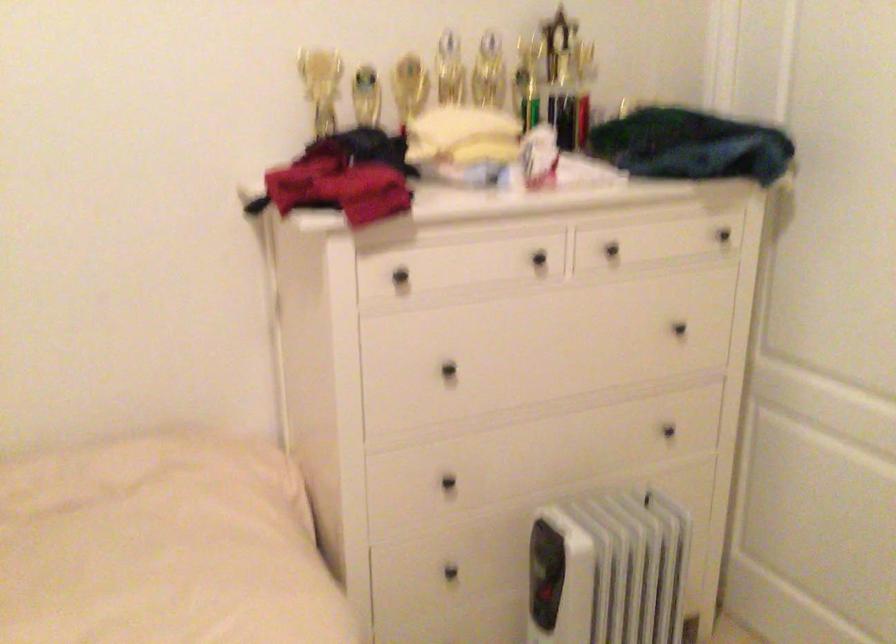
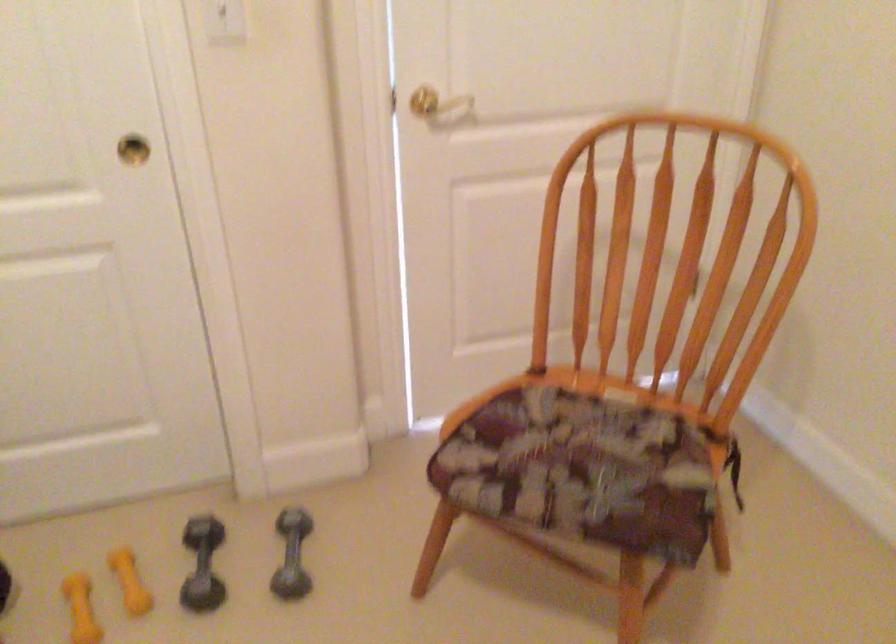
The first image is from the beginning of the video and the second image is from the end. How did the camera likely rotate when shooting the video?

The camera's rotation is toward right-down.